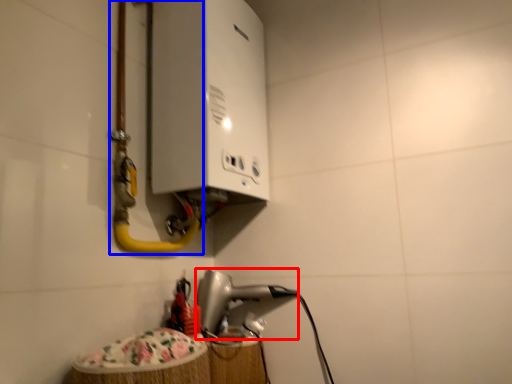
Question: Among these objects, which one is farthest to the camera, appliance (highlighted by a red box) or water pipe (highlighted by a blue box)?

Choices:
 (A) appliance
 (B) water pipe

Answer: (A)